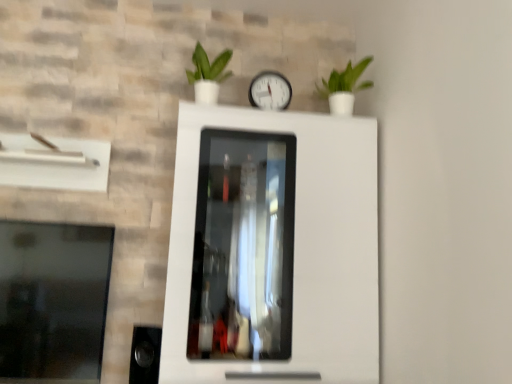
Where is `green matte plant at upper right, which appears as the second houseplant when viewed from the left`? This screenshot has height=384, width=512. green matte plant at upper right, which appears as the second houseplant when viewed from the left is located at coordinates (344, 87).

Identify the location of green matte plant at upper center, which ranks as the 1th houseplant in left-to-right order. Image resolution: width=512 pixels, height=384 pixels. (208, 74).

The width and height of the screenshot is (512, 384). What do you see at coordinates (53, 299) in the screenshot? I see `transparent glass window at left` at bounding box center [53, 299].

I want to click on green matte plant at upper right, which appears as the second houseplant when viewed from the left, so click(x=344, y=87).

From a real-world perspective, is green matte plant at upper center, which ranks as the 1th houseplant in left-to-right order, over transparent glass window at left?

Indeed, from a real-world perspective, green matte plant at upper center, which ranks as the 1th houseplant in left-to-right order, stands above transparent glass window at left.

Locate an element on the screen. window in front of the green matte plant at upper center, which ranks as the 1th houseplant in left-to-right order is located at coordinates (53, 299).

Looking at this image, from the image's perspective, is green matte plant at upper center, which ranks as the 1th houseplant in left-to-right order, below transparent glass window at left?

Incorrect, from the image's perspective, green matte plant at upper center, which ranks as the 1th houseplant in left-to-right order, is higher than transparent glass window at left.

Considering the relative sizes of green matte plant at upper center, which ranks as the 1th houseplant in left-to-right order, and transparent glass window at left in the image provided, is green matte plant at upper center, which ranks as the 1th houseplant in left-to-right order, taller than transparent glass window at left?

Incorrect, the height of green matte plant at upper center, which ranks as the 1th houseplant in left-to-right order, is not larger of that of transparent glass window at left.

Is green matte plant at upper right, which appears as the second houseplant when viewed from the left, bigger than white plastic clock at center?

Correct, green matte plant at upper right, which appears as the second houseplant when viewed from the left, is larger in size than white plastic clock at center.

Is the depth of green matte plant at upper right, which appears as the second houseplant when viewed from the left, greater than that of white plastic clock at center?

No, green matte plant at upper right, which appears as the second houseplant when viewed from the left, is closer to the viewer.

Based on the photo, which object is thinner, green matte plant at upper right, which appears as the second houseplant when viewed from the left, or white plastic clock at center?

white plastic clock at center.

From the image's perspective, which object appears higher, green matte plant at upper right, arranged as the first houseplant when viewed from the right, or green matte plant at upper center, which ranks as the 1th houseplant in left-to-right order?

From the image's view, green matte plant at upper center, which ranks as the 1th houseplant in left-to-right order, is above.

Is green matte plant at upper right, which appears as the second houseplant when viewed from the left, far from green matte plant at upper center, the 2th houseplant from the right?

No, there isn't a large distance between green matte plant at upper right, which appears as the second houseplant when viewed from the left, and green matte plant at upper center, the 2th houseplant from the right.

Which of these two, green matte plant at upper right, which appears as the second houseplant when viewed from the left, or green matte plant at upper center, the 2th houseplant from the right, is wider?

green matte plant at upper center, the 2th houseplant from the right, is wider.

Considering the sizes of objects green matte plant at upper right, which appears as the second houseplant when viewed from the left, and green matte plant at upper center, which ranks as the 1th houseplant in left-to-right order, in the image provided, who is smaller, green matte plant at upper right, which appears as the second houseplant when viewed from the left, or green matte plant at upper center, which ranks as the 1th houseplant in left-to-right order,?

With smaller size is green matte plant at upper center, which ranks as the 1th houseplant in left-to-right order.

From a real-world perspective, which object rests below the other?

green matte plant at upper center, the 2th houseplant from the right, from a real-world perspective.

Where is `houseplant above the green matte plant at upper center, the 2th houseplant from the right (from a real-world perspective)`? The height and width of the screenshot is (384, 512). houseplant above the green matte plant at upper center, the 2th houseplant from the right (from a real-world perspective) is located at coordinates (344, 87).

Based on their positions, is green matte plant at upper center, the 2th houseplant from the right, located to the left or right of green matte plant at upper right, arranged as the first houseplant when viewed from the right?

green matte plant at upper center, the 2th houseplant from the right, is to the left of green matte plant at upper right, arranged as the first houseplant when viewed from the right.

Does point (218, 90) come farther from viewer compared to point (328, 98)?

Yes, point (218, 90) is farther from viewer.

Is transparent glass window at left not close to green matte plant at upper right, arranged as the first houseplant when viewed from the right?

Yes.

Considering the sizes of objects transparent glass window at left and green matte plant at upper right, which appears as the second houseplant when viewed from the left, in the image provided, who is thinner, transparent glass window at left or green matte plant at upper right, which appears as the second houseplant when viewed from the left,?

transparent glass window at left is thinner.

In the image, is transparent glass window at left on the left side or the right side of green matte plant at upper right, which appears as the second houseplant when viewed from the left?

In the image, transparent glass window at left appears on the left side of green matte plant at upper right, which appears as the second houseplant when viewed from the left.

Considering the relative sizes of green matte plant at upper right, arranged as the first houseplant when viewed from the right, and transparent glass window at left in the image provided, is green matte plant at upper right, arranged as the first houseplant when viewed from the right, taller than transparent glass window at left?

In fact, green matte plant at upper right, arranged as the first houseplant when viewed from the right, may be shorter than transparent glass window at left.

Between green matte plant at upper right, arranged as the first houseplant when viewed from the right, and transparent glass window at left, which one appears on the left side from the viewer's perspective?

From the viewer's perspective, transparent glass window at left appears more on the left side.

Considering the relative sizes of green matte plant at upper right, which appears as the second houseplant when viewed from the left, and transparent glass window at left in the image provided, is green matte plant at upper right, which appears as the second houseplant when viewed from the left, smaller than transparent glass window at left?

Indeed, green matte plant at upper right, which appears as the second houseplant when viewed from the left, has a smaller size compared to transparent glass window at left.

Starting from the transparent glass window at left, which houseplant is the 2nd one behind? Please provide its 2D coordinates.

[(344, 87)]

Is green matte plant at upper center, which ranks as the 1th houseplant in left-to-right order, positioned beyond the bounds of white plastic clock at center?

Yes, green matte plant at upper center, which ranks as the 1th houseplant in left-to-right order, is not within white plastic clock at center.

Where is `clock on the right of green matte plant at upper center, which ranks as the 1th houseplant in left-to-right order`? clock on the right of green matte plant at upper center, which ranks as the 1th houseplant in left-to-right order is located at coordinates (270, 91).

Is point (207, 81) less distant than point (271, 94)?

Yes.

What are the coordinates of `window in front of the green matte plant at upper center, the 2th houseplant from the right` in the screenshot? It's located at (53, 299).

Locate an element on the screen. This screenshot has height=384, width=512. clock on the left of green matte plant at upper right, arranged as the first houseplant when viewed from the right is located at coordinates (270, 91).

Based on their spatial positions, is white plastic clock at center or green matte plant at upper center, the 2th houseplant from the right, closer to transparent glass window at left?

Based on the image, green matte plant at upper center, the 2th houseplant from the right, appears to be nearer to transparent glass window at left.

Based on their spatial positions, is green matte plant at upper center, which ranks as the 1th houseplant in left-to-right order, or white plastic clock at center further from transparent glass window at left?

white plastic clock at center.

When comparing their distances from green matte plant at upper right, which appears as the second houseplant when viewed from the left, does white plastic clock at center or green matte plant at upper center, the 2th houseplant from the right, seem closer?

Among the two, white plastic clock at center is located nearer to green matte plant at upper right, which appears as the second houseplant when viewed from the left.

Looking at the image, which one is located closer to green matte plant at upper center, which ranks as the 1th houseplant in left-to-right order, white plastic clock at center or transparent glass window at left?

white plastic clock at center is positioned closer to the anchor green matte plant at upper center, which ranks as the 1th houseplant in left-to-right order.

Based on their spatial positions, is green matte plant at upper center, which ranks as the 1th houseplant in left-to-right order, or green matte plant at upper right, which appears as the second houseplant when viewed from the left, closer to transparent glass window at left?

green matte plant at upper center, which ranks as the 1th houseplant in left-to-right order, is positioned closer to the anchor transparent glass window at left.

From the image, which object appears to be nearer to green matte plant at upper center, which ranks as the 1th houseplant in left-to-right order, green matte plant at upper right, which appears as the second houseplant when viewed from the left, or white plastic clock at center?

Among the two, white plastic clock at center is located nearer to green matte plant at upper center, which ranks as the 1th houseplant in left-to-right order.

Which object lies nearer to the anchor point green matte plant at upper right, which appears as the second houseplant when viewed from the left, transparent glass window at left or green matte plant at upper center, the 2th houseplant from the right?

Based on the image, green matte plant at upper center, the 2th houseplant from the right, appears to be nearer to green matte plant at upper right, which appears as the second houseplant when viewed from the left.

Estimate the real-world distances between objects in this image. Which object is further from white plastic clock at center, green matte plant at upper right, arranged as the first houseplant when viewed from the right, or transparent glass window at left?

Among the two, transparent glass window at left is located further to white plastic clock at center.

What are the coordinates of `clock located between transparent glass window at left and green matte plant at upper right, which appears as the second houseplant when viewed from the left, in the left-right direction` in the screenshot? It's located at (270, 91).

Image resolution: width=512 pixels, height=384 pixels. I want to click on clock between green matte plant at upper center, which ranks as the 1th houseplant in left-to-right order, and transparent glass window at left in the up-down direction, so click(270, 91).

Identify the location of houseplant located between transparent glass window at left and green matte plant at upper right, which appears as the second houseplant when viewed from the left, in the left-right direction. This screenshot has height=384, width=512. (208, 74).

I want to click on clock between green matte plant at upper center, the 2th houseplant from the right, and green matte plant at upper right, arranged as the first houseplant when viewed from the right, from left to right, so click(x=270, y=91).